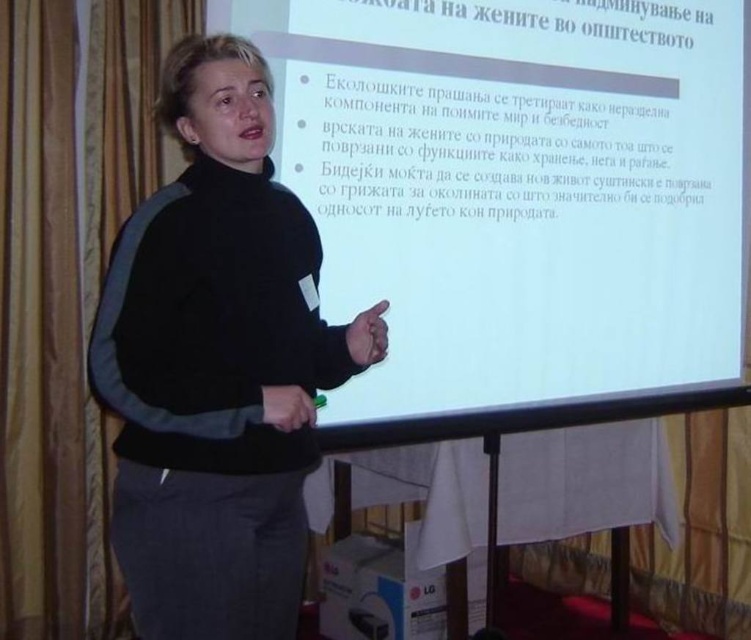
Question: Observing the image, what is the correct spatial positioning of black fabric jacket at center in reference to gold fabric curtain at left?

Choices:
 (A) below
 (B) above

Answer: (A)

Question: Among these objects, which one is farthest from the camera?

Choices:
 (A) gold fabric curtain at left
 (B) white matte projection screen at upper center

Answer: (A)

Question: From the image, what is the correct spatial relationship of white matte projection screen at upper center in relation to black fabric jacket at center?

Choices:
 (A) left
 (B) right

Answer: (B)

Question: Estimate the real-world distances between objects in this image. Which object is farther from the gold fabric curtain at left?

Choices:
 (A) white matte projection screen at upper center
 (B) black fabric jacket at center

Answer: (A)

Question: Is black fabric jacket at center thinner than gold fabric curtain at left?

Choices:
 (A) yes
 (B) no

Answer: (A)

Question: Which of the following is the closest to the observer?

Choices:
 (A) (493, 80)
 (B) (130, 291)

Answer: (B)